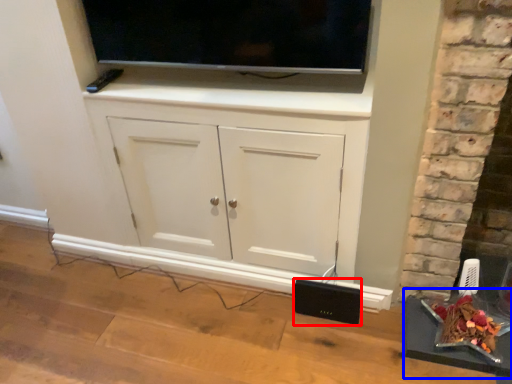
Question: Which point is further to the camera, speaker (highlighted by a red box) or table (highlighted by a blue box)?

Choices:
 (A) speaker
 (B) table

Answer: (A)